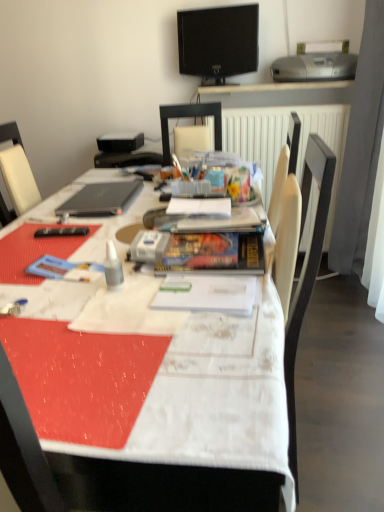
The image size is (384, 512). What are the coordinates of `free space in front of clear plastic bottle at center` in the screenshot? It's located at (102, 318).